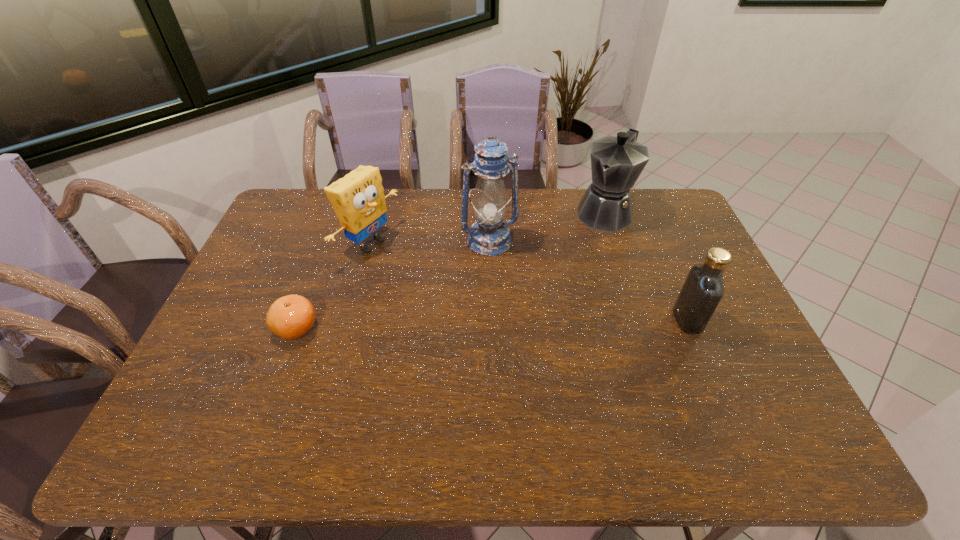
Where is `vacant space on the desktop that is between the clementine and the vodka and is positioned on the face of the sponge`? vacant space on the desktop that is between the clementine and the vodka and is positioned on the face of the sponge is located at coordinates (533, 323).

Locate an element on the screen. The width and height of the screenshot is (960, 540). vacant spot on the desktop that is between the clementine and the rightmost object and is positioned on the front-facing side of the third object from right to left is located at coordinates (532, 323).

The width and height of the screenshot is (960, 540). I want to click on vacant spot on the desktop that is between the clementine and the vodka and is positioned at the spout of the second tallest object, so click(x=522, y=323).